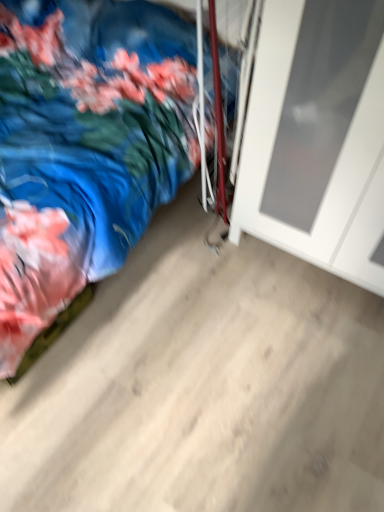
Question: Is white matte door at right closer to the viewer compared to blue satin bed at lower left?

Choices:
 (A) yes
 (B) no

Answer: (B)

Question: Is white matte door at right positioned with its back to blue satin bed at lower left?

Choices:
 (A) yes
 (B) no

Answer: (B)

Question: Can you confirm if white matte door at right is smaller than blue satin bed at lower left?

Choices:
 (A) yes
 (B) no

Answer: (A)

Question: Can you confirm if white matte door at right is bigger than blue satin bed at lower left?

Choices:
 (A) no
 (B) yes

Answer: (A)

Question: Does white matte door at right appear on the right side of blue satin bed at lower left?

Choices:
 (A) no
 (B) yes

Answer: (B)

Question: Can you confirm if white matte door at right is positioned to the left of blue satin bed at lower left?

Choices:
 (A) yes
 (B) no

Answer: (B)

Question: From the image's perspective, is blue satin bed at lower left on top of white matte door at right?

Choices:
 (A) yes
 (B) no

Answer: (A)

Question: Is blue satin bed at lower left located outside white matte door at right?

Choices:
 (A) no
 (B) yes

Answer: (B)

Question: Could you tell me if blue satin bed at lower left is facing white matte door at right?

Choices:
 (A) yes
 (B) no

Answer: (A)

Question: Is blue satin bed at lower left further to the viewer compared to white matte door at right?

Choices:
 (A) no
 (B) yes

Answer: (A)

Question: From the image's perspective, is blue satin bed at lower left beneath white matte door at right?

Choices:
 (A) yes
 (B) no

Answer: (B)

Question: Is blue satin bed at lower left facing away from white matte door at right?

Choices:
 (A) yes
 (B) no

Answer: (B)

Question: Is point (372, 114) positioned closer to the camera than point (26, 335)?

Choices:
 (A) closer
 (B) farther

Answer: (A)